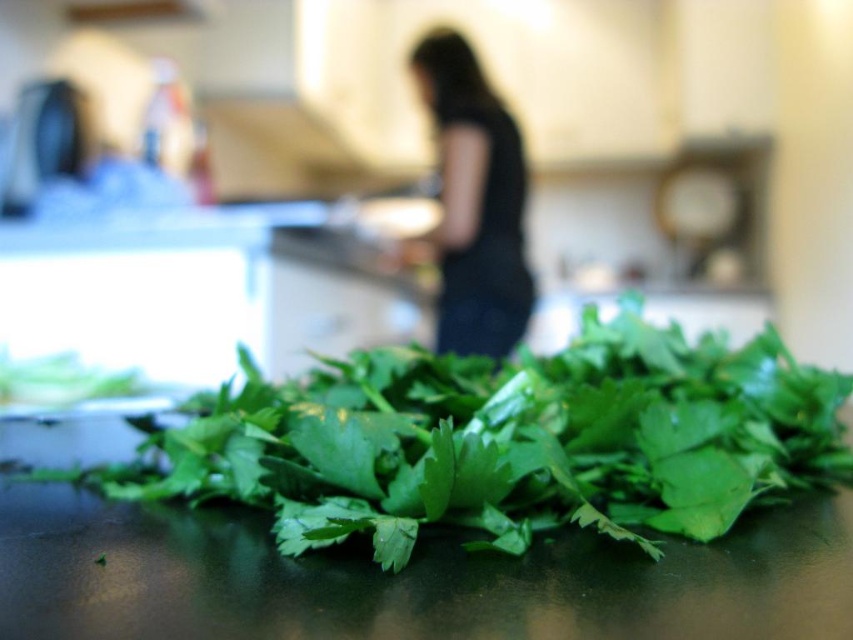
Question: Does green leafy at center have a larger size compared to black fabric at center?

Choices:
 (A) no
 (B) yes

Answer: (A)

Question: Where is green leafy at center located in relation to black fabric at center in the image?

Choices:
 (A) right
 (B) left

Answer: (B)

Question: Is green leafy at center bigger than black fabric at center?

Choices:
 (A) yes
 (B) no

Answer: (B)